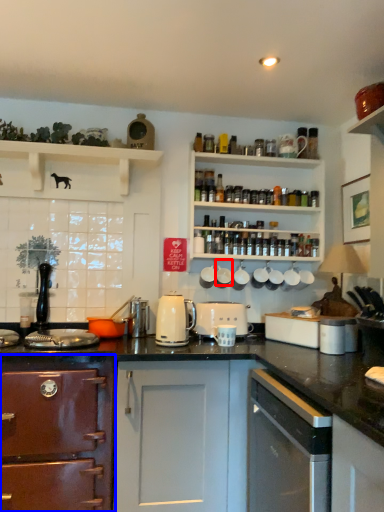
Question: Which object appears farthest to the camera in this image, appliance (highlighted by a red box) or cabinetry (highlighted by a blue box)?

Choices:
 (A) appliance
 (B) cabinetry

Answer: (A)